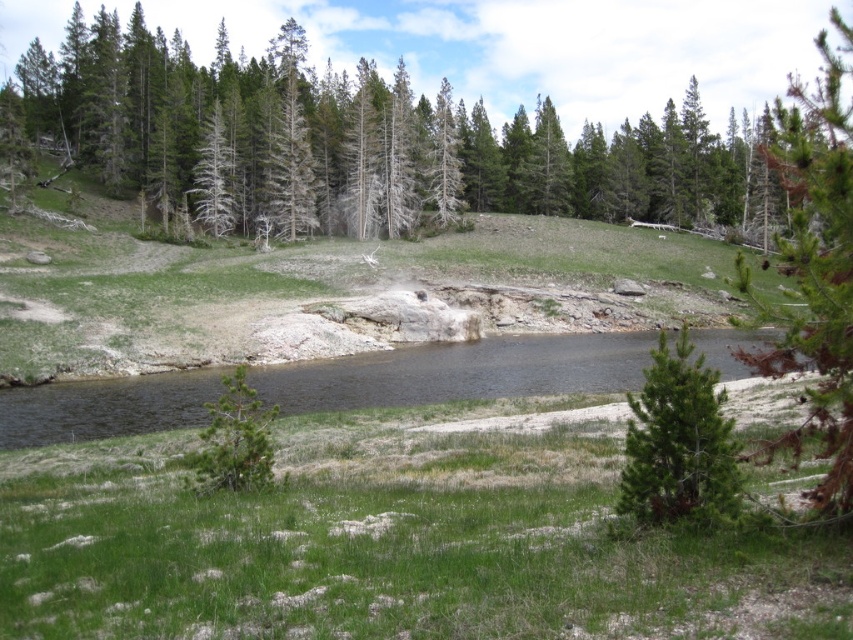
Who is lower down, dark brown water at center or green matte tree at lower right?

dark brown water at center is lower down.

The height and width of the screenshot is (640, 853). Identify the location of dark brown water at center. (459, 372).

Where is `dark brown water at center`? dark brown water at center is located at coordinates (459, 372).

Is green grassy hillside at center below green matte tree at lower right?

Actually, green grassy hillside at center is above green matte tree at lower right.

Describe the element at coordinates (323, 291) in the screenshot. I see `green grassy hillside at center` at that location.

Where is `green grassy hillside at center`? green grassy hillside at center is located at coordinates (323, 291).

Consider the image. Who is positioned more to the left, dark brown water at center or green textured tree at upper center?

dark brown water at center

Is dark brown water at center above green textured tree at upper center?

No, dark brown water at center is not above green textured tree at upper center.

Image resolution: width=853 pixels, height=640 pixels. I want to click on dark brown water at center, so click(459, 372).

Find the location of a particular element. dark brown water at center is located at coordinates (x=459, y=372).